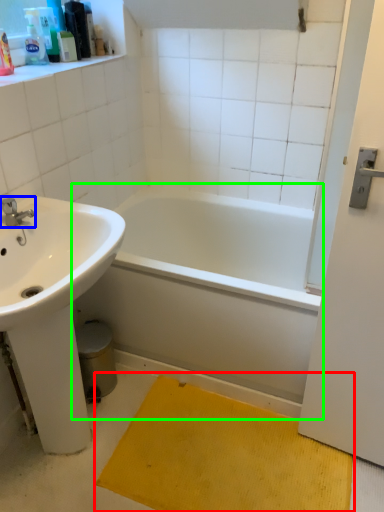
Question: Which object is the farthest from doormat (highlighted by a red box)? Choose among these: tap (highlighted by a blue box) or bathtub (highlighted by a green box).

Choices:
 (A) tap
 (B) bathtub

Answer: (A)